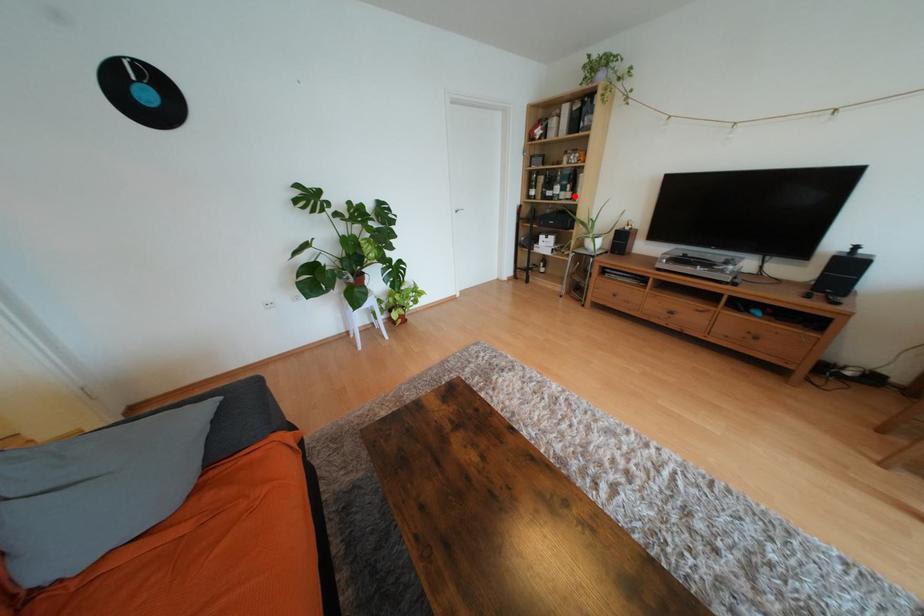
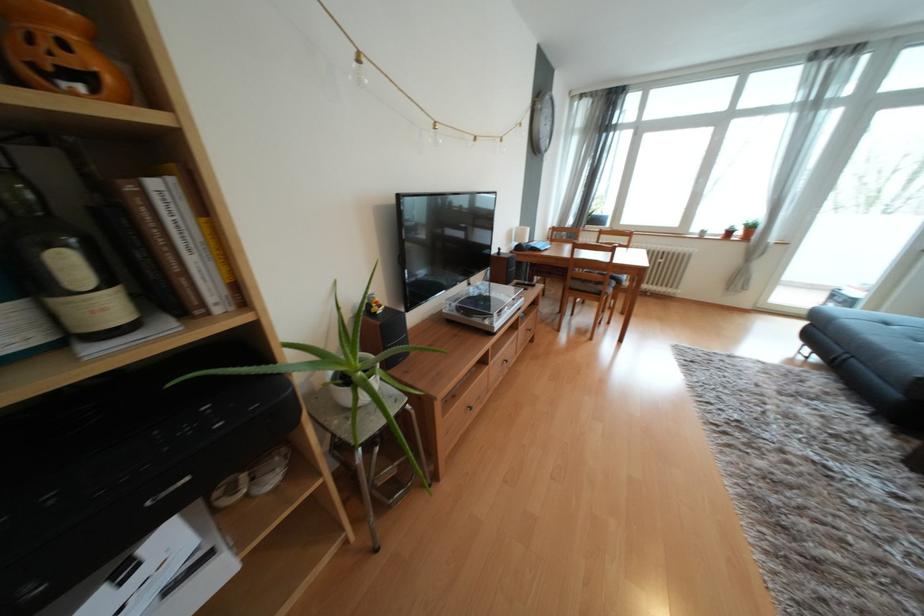
Find the pixel in the second image that matches the highlighted location in the first image.

(111, 308)